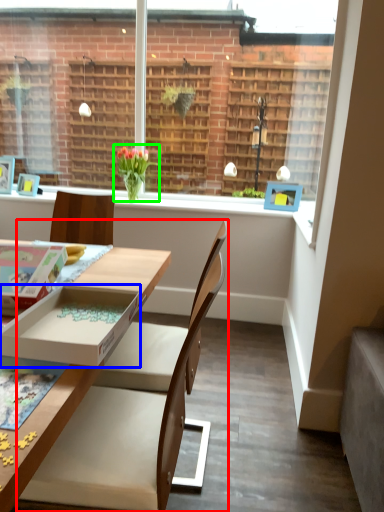
Question: Which object is the closest to the chair (highlighted by a red box)? Choose among these: box (highlighted by a blue box) or houseplant (highlighted by a green box).

Choices:
 (A) box
 (B) houseplant

Answer: (A)